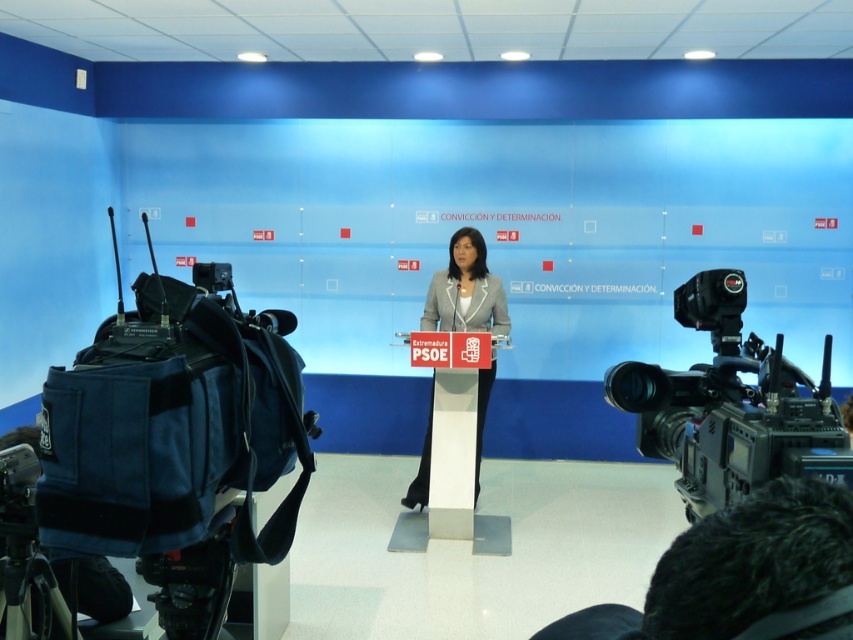
Question: Which point is closer to the camera taking this photo?

Choices:
 (A) (206, 573)
 (B) (741, 429)
 (C) (756, 588)
 (D) (25, 554)

Answer: (C)

Question: Is black plastic video camera at right bigger than black fabric tripod at lower left?

Choices:
 (A) yes
 (B) no

Answer: (A)

Question: Considering the real-world distances, which object is closest to the black fabric tripod at lower left?

Choices:
 (A) dark hair at lower right
 (B) black plastic video camera at right

Answer: (B)

Question: Which object is positioned closest to the black plastic video camera at right?

Choices:
 (A) dark hair at lower right
 (B) light gray fabric jacket at center

Answer: (A)

Question: Is black plastic video camera at right in front of black fabric tripod at lower left?

Choices:
 (A) no
 (B) yes

Answer: (B)

Question: Can you confirm if blue fabric video camera at left is positioned to the left of light gray fabric jacket at center?

Choices:
 (A) no
 (B) yes

Answer: (B)